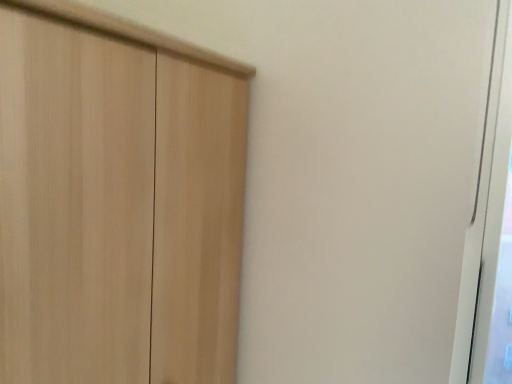
Measure the distance between light wood cupboard at left and camera.

light wood cupboard at left is 50.24 centimeters from camera.

Where is `light wood cupboard at left`? The width and height of the screenshot is (512, 384). light wood cupboard at left is located at coordinates (117, 201).

Image resolution: width=512 pixels, height=384 pixels. Describe the element at coordinates (117, 201) in the screenshot. I see `light wood cupboard at left` at that location.

Where is `light wood cupboard at left`? The width and height of the screenshot is (512, 384). light wood cupboard at left is located at coordinates (117, 201).